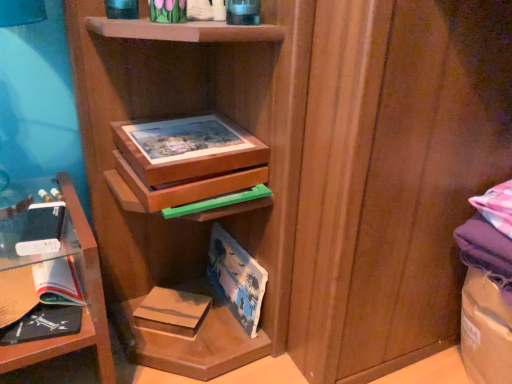
The height and width of the screenshot is (384, 512). Find the location of `unoccupied area in front of matte paper paperback book at center, arranged as the third paperback book when viewed from the left`. unoccupied area in front of matte paper paperback book at center, arranged as the third paperback book when viewed from the left is located at coordinates (231, 367).